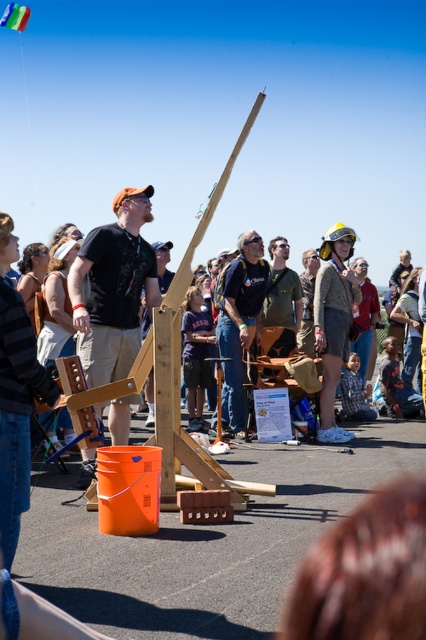
Question: Estimate the real-world distances between objects in this image. Which object is farther from the multicolored fabric kite at center?

Choices:
 (A) matte green shirt at center
 (B) matte blue shirt at center
 (C) matte black shirt at center

Answer: (C)

Question: Which point is closer to the camera?

Choices:
 (A) matte black shirt at center
 (B) multicolored fabric kite at center

Answer: (A)

Question: Which point is farther from the camera taking this photo?

Choices:
 (A) (97, 307)
 (B) (284, 262)

Answer: (B)

Question: Can you confirm if matte black shirt at center is positioned below multicolored fabric kite at center?

Choices:
 (A) yes
 (B) no

Answer: (A)

Question: Does matte green shirt at center have a larger size compared to multicolored fabric kite at center?

Choices:
 (A) no
 (B) yes

Answer: (A)

Question: Is matte black shirt at center positioned at the back of multicolored fabric kite at center?

Choices:
 (A) no
 (B) yes

Answer: (A)